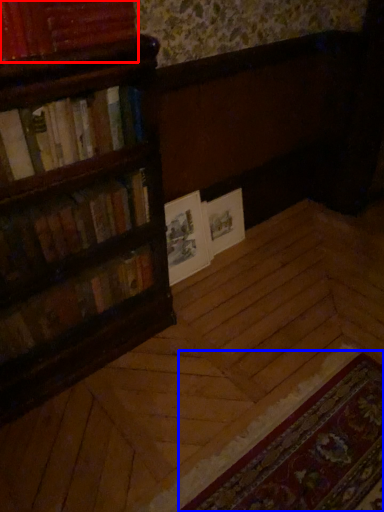
Question: Which object appears closest to the camera in this image, book (highlighted by a red box) or mat (highlighted by a blue box)?

Choices:
 (A) book
 (B) mat

Answer: (B)